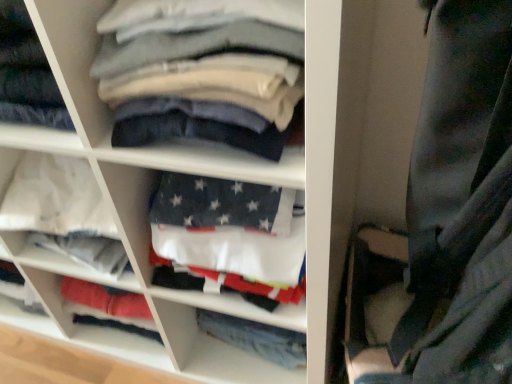
Where is `denim pants at center`? This screenshot has height=384, width=512. denim pants at center is located at coordinates (256, 338).

At what (x,y) coordinates should I click in order to perform the action: click on white fabric at center. Please return your answer as a coordinate pair (x, y). The height and width of the screenshot is (384, 512). Looking at the image, I should click on (64, 212).

Can you confirm if smooth cotton shirts at center is shorter than white fabric at center?

Yes.

Which object is more forward, smooth cotton shirts at center or white fabric at center?

smooth cotton shirts at center is closer to the camera.

From the image's perspective, is smooth cotton shirts at center on white fabric at center?

Yes.

Is smooth cotton shirts at center turned away from white fabric at center?

No.

Is white cotton shirts at center further to camera compared to denim pants at center?

No, white cotton shirts at center is in front of denim pants at center.

Are white cotton shirts at center and denim pants at center far apart?

No, white cotton shirts at center is not far from denim pants at center.

Is white cotton shirts at center turned away from denim pants at center?

Absolutely, white cotton shirts at center is directed away from denim pants at center.

Between white cotton shirts at center and white fabric at center, which one has larger width?

white cotton shirts at center.

Is there a large distance between white cotton shirts at center and white fabric at center?

They are positioned close to each other.

Which of these two, white cotton shirts at center or white fabric at center, stands shorter?

white fabric at center is shorter.

Which object is further away from the camera, white cotton shirts at center or white fabric at center?

white fabric at center is further from the camera.

From a real-world perspective, is denim pants at center below white fabric at center?

Indeed, from a real-world perspective, denim pants at center is positioned beneath white fabric at center.

Is denim pants at center positioned beyond the bounds of white fabric at center?

denim pants at center lies outside white fabric at center's area.

Which object is closer to the camera, denim pants at center or white fabric at center?

white fabric at center is in front.

Which point is more forward, (271, 338) or (16, 209)?

The point (16, 209) is closer to the camera.

Measure the distance between denim pants at center and smooth cotton shirts at center.

denim pants at center is 65.12 centimeters from smooth cotton shirts at center.

Is denim pants at center in front of or behind smooth cotton shirts at center in the image?

denim pants at center is behind smooth cotton shirts at center.

Is denim pants at center wider or thinner than smooth cotton shirts at center?

denim pants at center is thinner than smooth cotton shirts at center.

What's the angular difference between denim pants at center and smooth cotton shirts at center's facing directions?

They differ by 0.000249 degrees in their facing directions.

Based on the photo, is white fabric at center wider than white cotton shirts at center?

No, white fabric at center is not wider than white cotton shirts at center.

Does white fabric at center have a larger size compared to white cotton shirts at center?

No, white fabric at center is not bigger than white cotton shirts at center.

I want to click on cabinet lying behind the white cotton shirts at center, so click(x=64, y=212).

From a real-world perspective, between white fabric at center and white cotton shirts at center, who is vertically higher?

From a 3D spatial view, white fabric at center is above.

Which is in front, point (203, 326) or point (73, 24)?

Point (73, 24)

Which object is further away from the camera taking this photo, denim pants at center or white cotton shirts at center?

denim pants at center is more distant.

Where is `clothing above the white fabric at center (from the image's perspective)`? The height and width of the screenshot is (384, 512). clothing above the white fabric at center (from the image's perspective) is located at coordinates (203, 71).

I want to click on trousers on the right of white cotton shirts at center, so click(256, 338).

When comparing their distances from white fabric at center, does denim pants at center or white cotton shirts at center seem closer?

Among the two, white cotton shirts at center is located nearer to white fabric at center.

Which object lies nearer to the anchor point smooth cotton shirts at center, white fabric at center or denim pants at center?

white fabric at center lies closer to smooth cotton shirts at center than the other object.

Which object lies further to the anchor point smooth cotton shirts at center, denim pants at center or white cotton shirts at center?

denim pants at center.

When comparing their distances from white cotton shirts at center, does smooth cotton shirts at center or white fabric at center seem closer?

white fabric at center lies closer to white cotton shirts at center than the other object.

Which object lies further to the anchor point smooth cotton shirts at center, white cotton shirts at center or white fabric at center?

white fabric at center lies further to smooth cotton shirts at center than the other object.

Estimate the real-world distances between objects in this image. Which object is further from smooth cotton shirts at center, white fabric at center or white cotton shirts at center?

white fabric at center is further to smooth cotton shirts at center.

Based on their spatial positions, is white cotton shirts at center or smooth cotton shirts at center closer to denim pants at center?

The object closer to denim pants at center is white cotton shirts at center.

From the picture: Looking at the image, which one is located closer to white cotton shirts at center, denim pants at center or smooth cotton shirts at center?

smooth cotton shirts at center.

Locate an element on the screen. This screenshot has height=384, width=512. cabinet between smooth cotton shirts at center and denim pants at center from top to bottom is located at coordinates (64, 212).

Find the location of `clothing located between white cotton shirts at center and denim pants at center in the depth direction`. clothing located between white cotton shirts at center and denim pants at center in the depth direction is located at coordinates (203, 71).

The width and height of the screenshot is (512, 384). In order to click on cabinet between white cotton shirts at center and denim pants at center from front to back in this screenshot , I will do tap(64, 212).

The width and height of the screenshot is (512, 384). I want to click on cabinet situated between white cotton shirts at center and smooth cotton shirts at center from left to right, so click(64, 212).